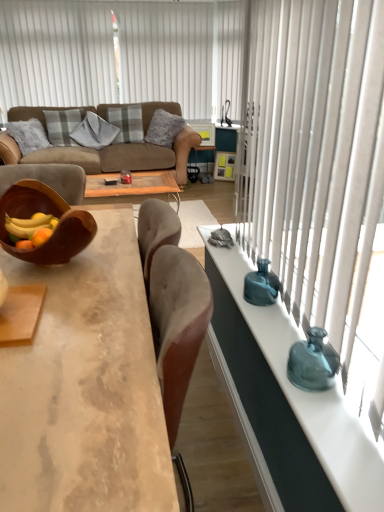
Question: Looking at the image, does gray textured pillow at center, the second pillow positioned from the left, seem bigger or smaller compared to concrete textured coffee table at center?

Choices:
 (A) small
 (B) big

Answer: (A)

Question: Would you say gray textured pillow at center, the second pillow positioned from the left, is to the left or to the right of concrete textured coffee table at center in the picture?

Choices:
 (A) right
 (B) left

Answer: (B)

Question: Which is farther from the white vertical blinds at upper left?

Choices:
 (A) gray textured pillow at center, the first pillow in the right-to-left sequence
 (B) teal glass vase at right
 (C) brown leather couch at upper left
 (D) teal glass vase at right, marked as the 2th vase in a back-to-front arrangement
 (E) plaid fabric pillow at upper left, the fourth pillow when ordered from right to left

Answer: (D)

Question: Estimate the real-world distances between objects in this image. Which object is closer to the plaid fabric pillow at center, placed as the third pillow when sorted from left to right?

Choices:
 (A) gray textured pillow at center, the 4th pillow in the left-to-right sequence
 (B) teal glass vase at right, marked as the 2th vase in a back-to-front arrangement
 (C) plaid fabric pillow at upper left, which is the 1th pillow from left to right
 (D) teal glass vase at right
 (E) teal glass vase at right

Answer: (A)